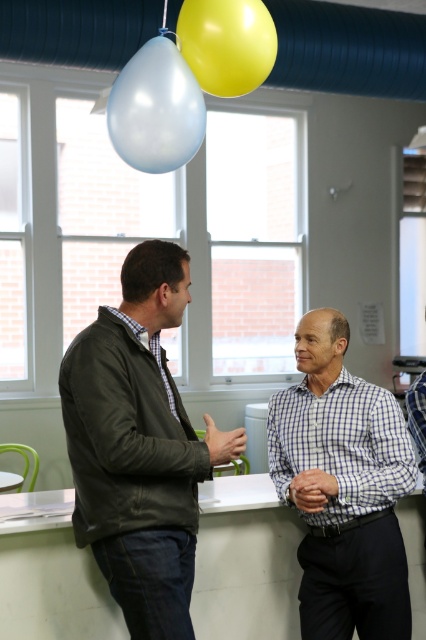
Does checkered shirt at center have a larger size compared to yellow rubber balloon at upper center?

Yes.

Between checkered shirt at center and yellow rubber balloon at upper center, which one appears on the right side from the viewer's perspective?

checkered shirt at center

The image size is (426, 640). Find the location of `checkered shirt at center`. checkered shirt at center is located at coordinates (342, 486).

Which is more to the left, checkered shirt at center or matte blue balloon at upper center?

Positioned to the left is matte blue balloon at upper center.

Is the position of checkered shirt at center more distant than that of matte blue balloon at upper center?

No.

Which is in front, point (325, 381) or point (158, 60)?

Point (325, 381)

I want to click on checkered shirt at center, so click(342, 486).

Does leather jacket at left appear under matte blue balloon at upper center?

Indeed, leather jacket at left is positioned under matte blue balloon at upper center.

Between point (160, 628) and point (176, 81), which one is positioned behind?

Point (176, 81)

I want to click on leather jacket at left, so click(x=138, y=445).